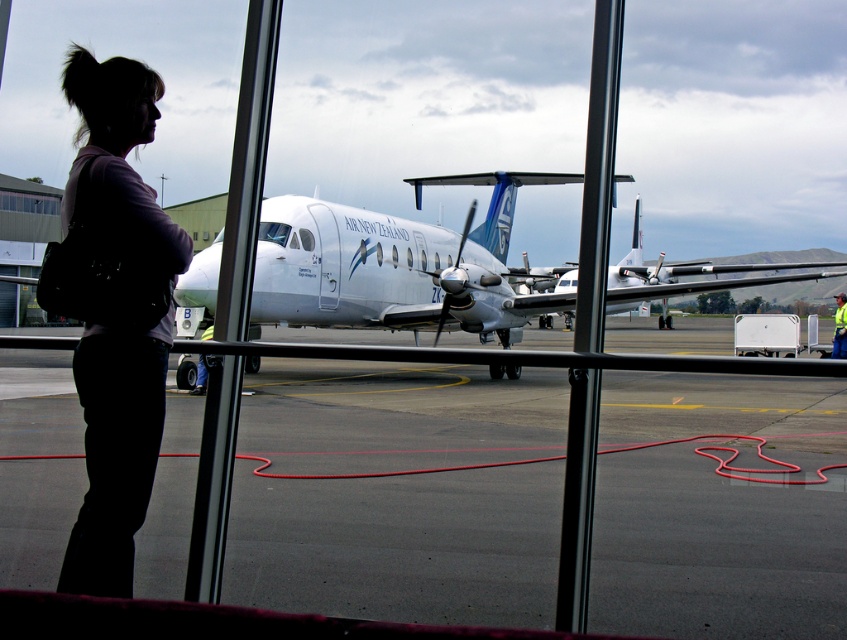
Question: Which object is the farthest from the black asphalt tarmac at center?

Choices:
 (A) white glossy airplane at center
 (B) yellow reflective vest at lower right

Answer: (B)

Question: Considering the real-world distances, which object is farthest from the black asphalt tarmac at center?

Choices:
 (A) white glossy airplane at center
 (B) yellow reflective vest at lower right
 (C) silhouette fabric bag at left

Answer: (B)

Question: Is black asphalt tarmac at center further to camera compared to white glossy airplane at center?

Choices:
 (A) no
 (B) yes

Answer: (B)

Question: Does silhouette fabric bag at left have a larger size compared to white glossy airplane at center?

Choices:
 (A) yes
 (B) no

Answer: (B)

Question: Which point is closer to the camera taking this photo?

Choices:
 (A) click(x=844, y=353)
 (B) click(x=58, y=250)
 (C) click(x=488, y=579)

Answer: (B)

Question: Does black asphalt tarmac at center lie behind white glossy airplane at center?

Choices:
 (A) yes
 (B) no

Answer: (A)